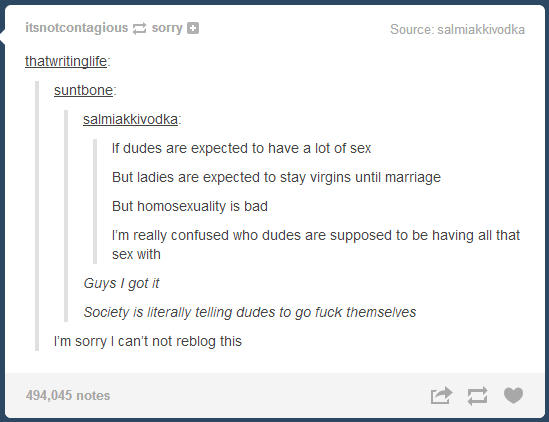
Where is `corners`? corners is located at coordinates (545, 418), (2, 417), (3, 7), (546, 3).